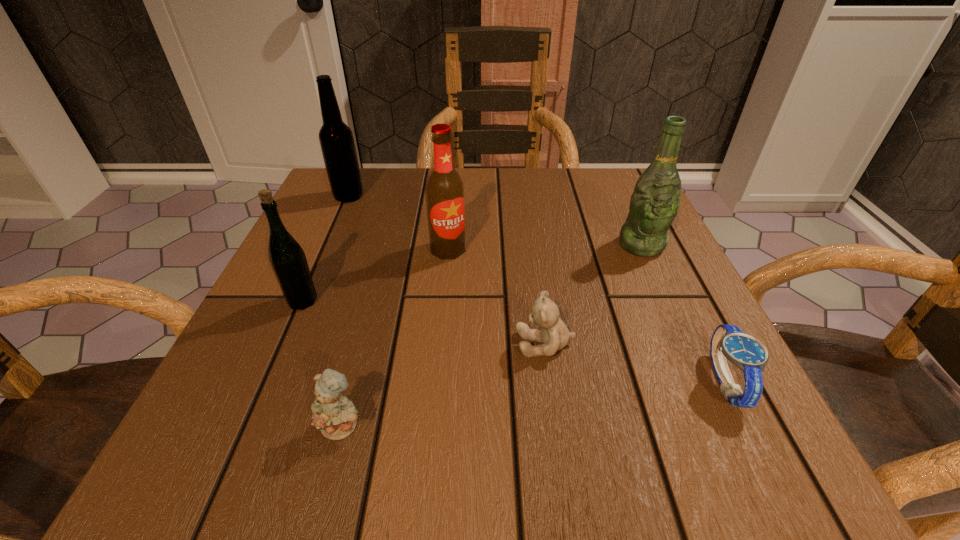
You are a GUI agent. You are given a task and a screenshot of the screen. Output one action in this format:
    pyautogui.click(x=<x>, y=<y>)
    Task: Click on the farthest beer bottle
    This screenshot has width=960, height=540.
    Given the screenshot: What is the action you would take?
    pyautogui.click(x=337, y=144)

What are the coordinates of `the rightmost beer bottle` in the screenshot? It's located at 654,204.

Locate an element on the screen. the second beer bottle from right to left is located at coordinates (444, 191).

The image size is (960, 540). I want to click on the shortest beer bottle, so click(x=287, y=258).

Locate an element on the screen. The image size is (960, 540). the nearest beer bottle is located at coordinates (287, 258).

The width and height of the screenshot is (960, 540). In order to click on the left teddy bear in this screenshot , I will do `click(335, 415)`.

Locate an element on the screen. The image size is (960, 540). the fifth object from right to left is located at coordinates (335, 415).

In order to click on the farther teddy bear in this screenshot , I will do `click(554, 335)`.

This screenshot has width=960, height=540. I want to click on the right teddy bear, so click(554, 335).

Where is `watch`? The width and height of the screenshot is (960, 540). watch is located at coordinates (728, 341).